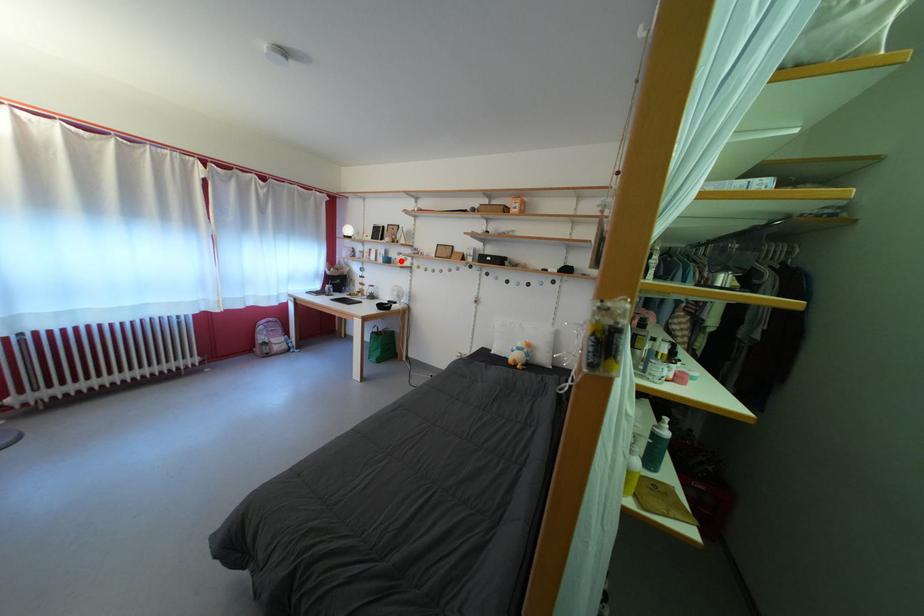
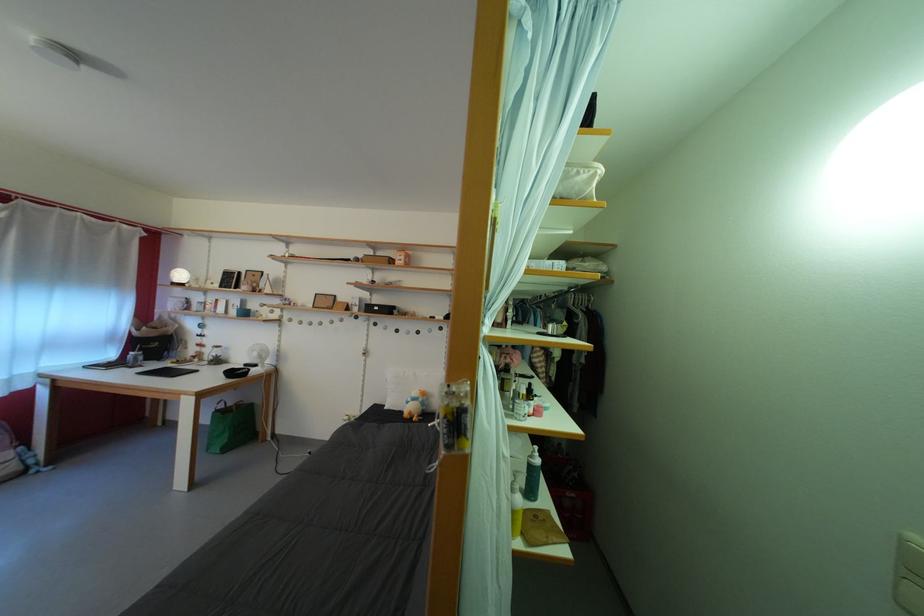
Question: I am providing you with two images of the same scene from different viewpoints. In image1, a red point is highlighted. Considering the same 3D point in image2, which of the following is correct?

Choices:
 (A) It is closer
 (B) It is farther

Answer: (B)